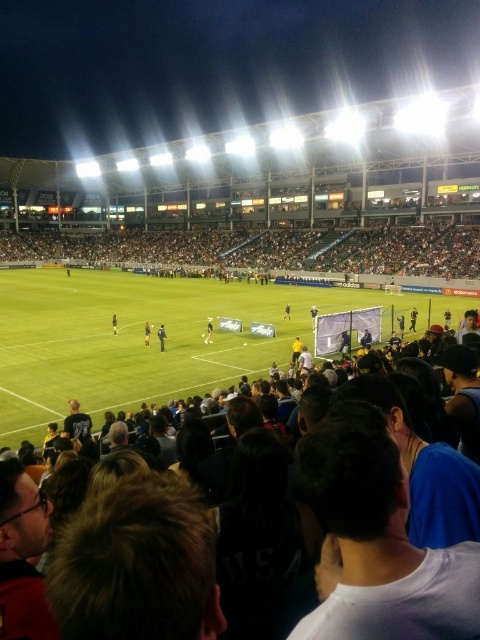
Question: Which object is farther from the camera taking this photo?

Choices:
 (A) dark blue uniform at center
 (B) dark blue fabric crowd at center

Answer: (B)

Question: Is black jersey at center smaller than dark blue jersey at center?

Choices:
 (A) yes
 (B) no

Answer: (B)

Question: Which of the following is the farthest from the observer?

Choices:
 (A) (214, 250)
 (B) (101, 337)

Answer: (A)

Question: Is dark blue uniform at center smaller than dark blue jersey at center?

Choices:
 (A) yes
 (B) no

Answer: (B)

Question: Does black jersey at center have a lesser width compared to dark blue jersey at center?

Choices:
 (A) no
 (B) yes

Answer: (A)

Question: Which of the following is the closest to the observer?

Choices:
 (A) dark blue fabric crowd at center
 (B) dark hair at center
 (C) dark blue jersey at center

Answer: (B)